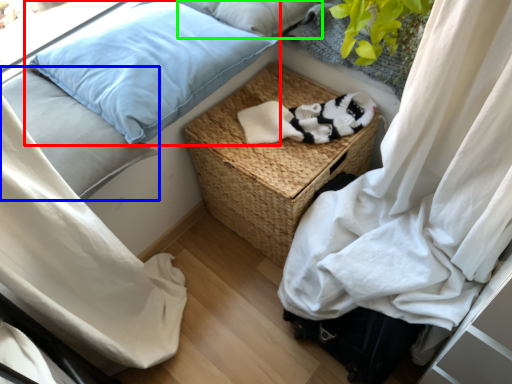
Question: Based on their relative distances, which object is farther from pillow (highlighted by a red box)? Choose from pillow (highlighted by a blue box) and pillow (highlighted by a green box).

Choices:
 (A) pillow
 (B) pillow

Answer: (B)